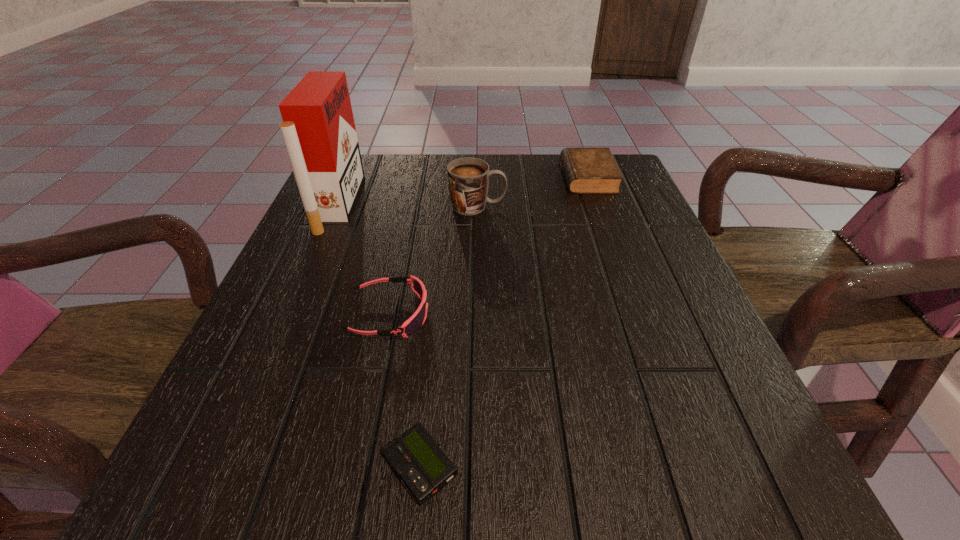
This screenshot has width=960, height=540. Find the location of `free space that is in between the beeper and the mug`. free space that is in between the beeper and the mug is located at coordinates (449, 336).

At what (x,y) coordinates should I click in order to perform the action: click on vacant region between the second tallest object and the shortest object. Please return your answer as a coordinate pair (x, y). The image size is (960, 540). Looking at the image, I should click on (449, 336).

Find the location of a particular element. Image resolution: width=960 pixels, height=540 pixels. free area in between the tallest object and the second nearest object is located at coordinates (x=364, y=259).

This screenshot has width=960, height=540. I want to click on vacant space in between the second tallest object and the rightmost object, so click(533, 192).

This screenshot has width=960, height=540. What are the coordinates of `free spot between the leftmost object and the fourth farthest object` in the screenshot? It's located at (364, 259).

Identify the location of free space between the mug and the beeper. (449, 336).

This screenshot has height=540, width=960. Identify the location of vacant point located between the goggles and the cigarette case. (364, 259).

Image resolution: width=960 pixels, height=540 pixels. Identify the location of the closest object to the fourth shortest object. (587, 170).

Find the location of `the second closest object relative to the mug`. the second closest object relative to the mug is located at coordinates (318, 129).

The height and width of the screenshot is (540, 960). Identify the location of vacant area that satisfies the following two spatial constraints: 1. on the front-facing side of the goggles; 2. on the right side of the beeper. (358, 467).